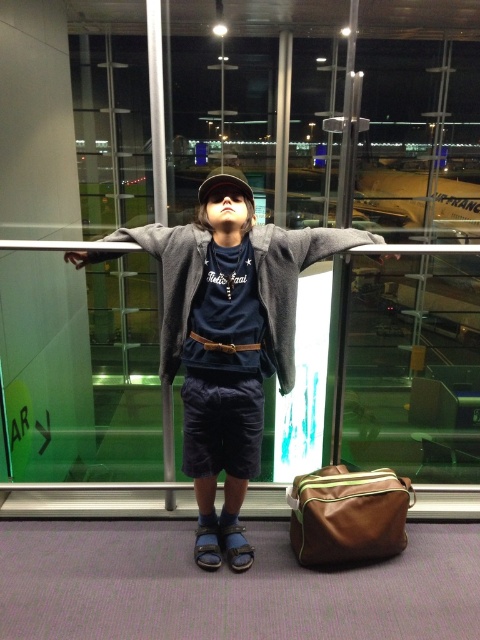
You are a photographer at the airport terminal. You need to adjust the lighting so that both the brown leather bag at lower right and the brown leather belt at center are clearly visible. Since the belt is behind the bag, will you need to adjust the camera angle to avoid the bag blocking the belt?

The brown leather belt at center is behind the brown leather bag at lower right, so adjusting the camera angle to move the bag out of the belt path would be necessary to ensure both are visible.

You are standing at the viewing platform and want to take a photo of the point at coordinates (406, 534). If your camera has a focal length of 50mm and you are 2.18 meters away from the point, what is the required distance in meters between the camera and the point to achieve a 1x magnification according to the pinhole camera model?

According to the pinhole camera model, the required distance between the camera and the point to achieve 1x magnification is equal to the focal length divided by the magnification factor. Since the magnification is 1x, the distance should be equal to the focal length. The focal length is 50mm, which is 0.05 meters. Therefore, the camera should be 0.05 meters away from the point to achieve 1x magnification.

You are a photographer setting up a shot of the matte gray hoodie at center and the brown leather belt at center. Which object should you focus on first if you want to capture both in the frame without moving the camera?

You should focus on the matte gray hoodie at center first because it is taller than the brown leather belt at center, ensuring it fits within the frame properly before adjusting for the belt.